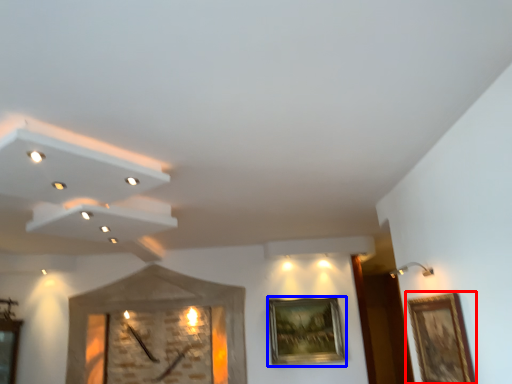
Question: Which object appears closest to the camera in this image, picture frame (highlighted by a red box) or picture frame (highlighted by a blue box)?

Choices:
 (A) picture frame
 (B) picture frame

Answer: (A)